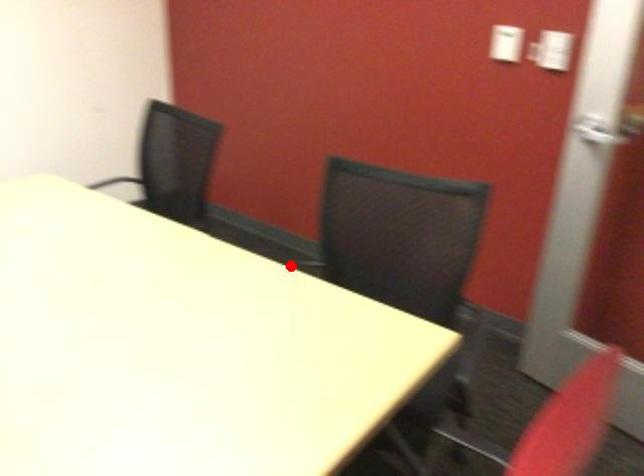
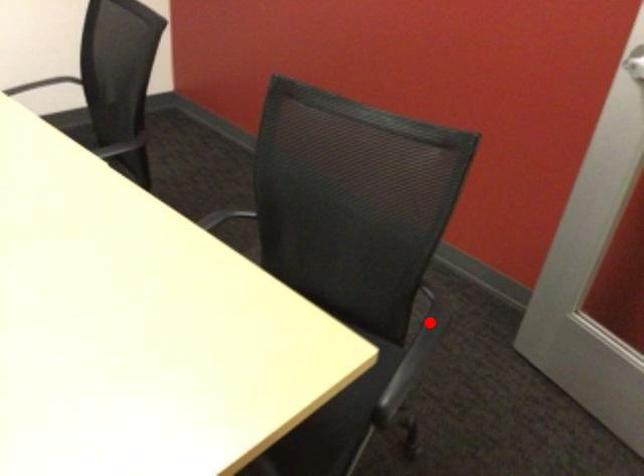
I am providing you with two images of the same scene from different viewpoints. A red point is marked on the first image and another point is marked on the second image. Is the red point in image1 aligned with the point shown in image2?

No